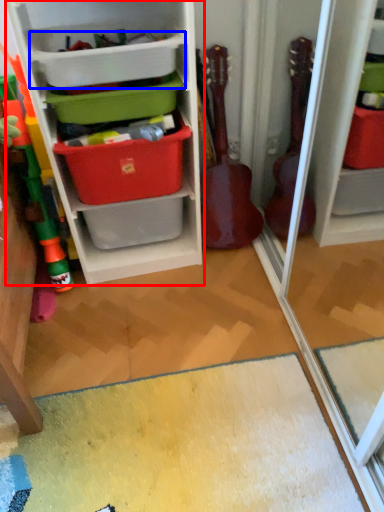
Question: Which object is further to the camera taking this photo, shelf (highlighted by a red box) or storage box (highlighted by a blue box)?

Choices:
 (A) shelf
 (B) storage box

Answer: (B)